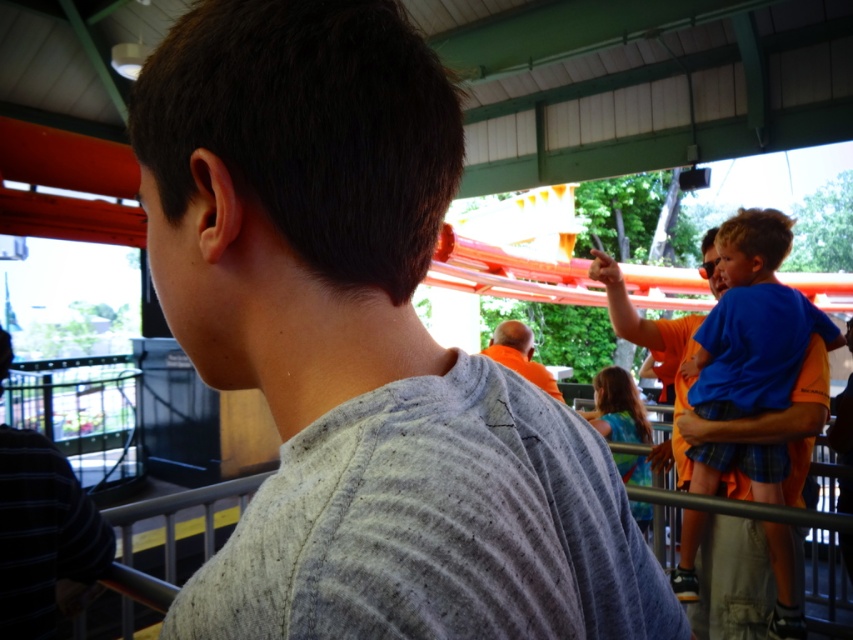
You are a photographer trying to capture a group photo of the gray cotton shirt at center and the blue denim shirt at center. Which of the two should you position closer to the camera to ensure both appear equally tall in the photo?

The gray cotton shirt at center is not as tall as the blue denim shirt at center, so you should position the gray cotton shirt at center closer to the camera to make them appear the same height in the photo.

You are a photographer trying to capture a photo of both the blue cotton shirt at right and the blue denim shirt at center. Which one should you focus on first to ensure both are in frame?

The blue cotton shirt at right is taller than the blue denim shirt at center, so you should focus on the blue denim shirt at center first to ensure both are in frame.

You are a photographer trying to capture a group photo of the blue cotton shirt at right and the striped cotton shirt at left. Based on their heights, which shirt should be positioned at the back to ensure both are fully visible in the photo?

The blue cotton shirt at right should be positioned at the back because it has a greater height than the striped cotton shirt at left, allowing both to be fully visible in the photo.